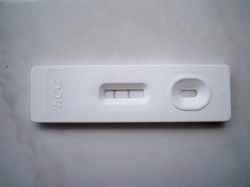
Image resolution: width=250 pixels, height=187 pixels. In order to click on window in this screenshot , I will do (190, 94).